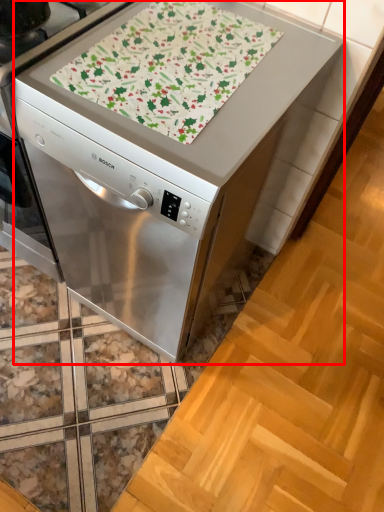
Question: Where is home appliance (annotated by the red box) located in relation to blanket in the image?

Choices:
 (A) right
 (B) left

Answer: (B)